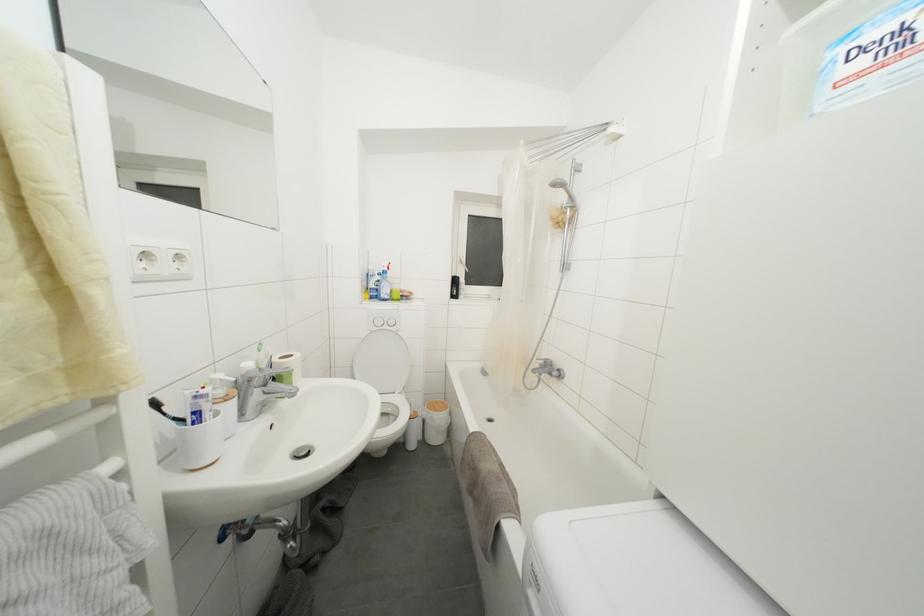
The height and width of the screenshot is (616, 924). What are the coordinates of `small trash can lid` in the screenshot? It's located at (436, 406).